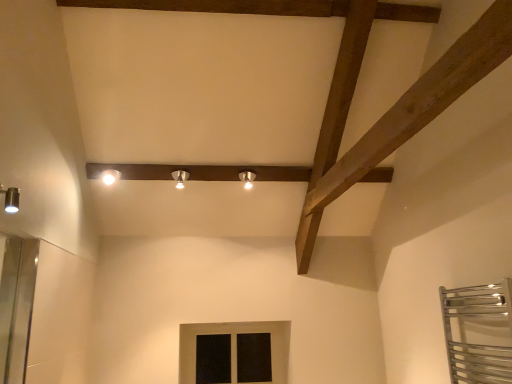
Question: Is black glass window at center positioned in front of white glossy spotlight at upper center, the 1th light fixture positioned from the left?

Choices:
 (A) yes
 (B) no

Answer: (B)

Question: Is black glass window at center taller than white glossy spotlight at upper center, placed as the third light fixture when sorted from right to left?

Choices:
 (A) yes
 (B) no

Answer: (A)

Question: Is black glass window at center turned away from white glossy spotlight at upper center, placed as the third light fixture when sorted from right to left?

Choices:
 (A) no
 (B) yes

Answer: (A)

Question: Is black glass window at center further to the viewer compared to white glossy spotlight at upper center, the 1th light fixture positioned from the left?

Choices:
 (A) no
 (B) yes

Answer: (B)

Question: Is black glass window at center outside white glossy spotlight at upper center, the 1th light fixture positioned from the left?

Choices:
 (A) no
 (B) yes

Answer: (B)

Question: Can you confirm if black glass window at center is positioned to the left of white glossy spotlight at upper center, the 1th light fixture positioned from the left?

Choices:
 (A) yes
 (B) no

Answer: (B)

Question: Is matte silver spotlight at center, positioned as the 2th light fixture in left-to-right order, at the left side of matte silver spotlight at center, positioned as the 3th light fixture in left-to-right order?

Choices:
 (A) yes
 (B) no

Answer: (A)

Question: Is matte silver spotlight at center, positioned as the 2th light fixture in left-to-right order, not near matte silver spotlight at center, the 1th light fixture positioned from the right?

Choices:
 (A) yes
 (B) no

Answer: (B)

Question: Does matte silver spotlight at center, marked as the 2th light fixture in a right-to-left arrangement, appear on the right side of matte silver spotlight at center, the 1th light fixture positioned from the right?

Choices:
 (A) no
 (B) yes

Answer: (A)

Question: From a real-world perspective, is matte silver spotlight at center, marked as the 2th light fixture in a right-to-left arrangement, beneath matte silver spotlight at center, the 1th light fixture positioned from the right?

Choices:
 (A) no
 (B) yes

Answer: (A)

Question: Is matte silver spotlight at center, positioned as the 2th light fixture in left-to-right order, positioned in front of matte silver spotlight at center, the 1th light fixture positioned from the right?

Choices:
 (A) yes
 (B) no

Answer: (A)

Question: From a real-world perspective, is matte silver spotlight at center, marked as the 2th light fixture in a right-to-left arrangement, on top of matte silver spotlight at center, positioned as the 3th light fixture in left-to-right order?

Choices:
 (A) no
 (B) yes

Answer: (B)

Question: From the image's perspective, is matte silver spotlight at center, positioned as the 2th light fixture in left-to-right order, located beneath white glossy spotlight at upper center, placed as the third light fixture when sorted from right to left?

Choices:
 (A) no
 (B) yes

Answer: (B)